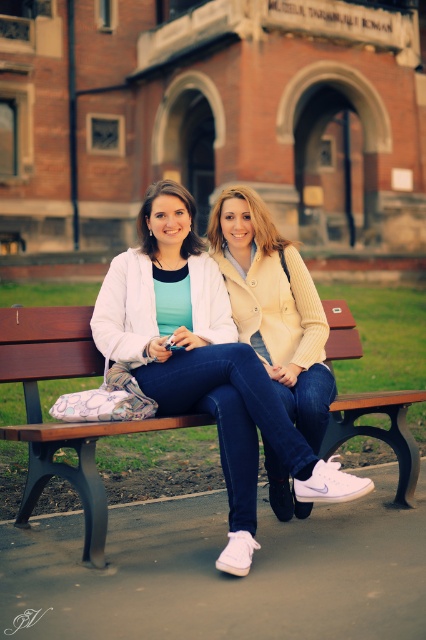
Question: Does wooden bench at center appear on the right side of matte yellow jacket at center?

Choices:
 (A) no
 (B) yes

Answer: (B)

Question: Can you confirm if wooden bench at center is thinner than matte yellow jacket at center?

Choices:
 (A) yes
 (B) no

Answer: (B)

Question: Which of the following is the closest to the observer?

Choices:
 (A) wooden bench at center
 (B) matte yellow jacket at center

Answer: (A)

Question: Can you confirm if wooden bench at center is positioned above matte yellow jacket at center?

Choices:
 (A) yes
 (B) no

Answer: (B)

Question: Which of the following is the farthest from the observer?

Choices:
 (A) (299, 348)
 (B) (69, 324)

Answer: (A)

Question: Which object is farther from the camera taking this photo?

Choices:
 (A) matte yellow jacket at center
 (B) wooden bench at center

Answer: (A)